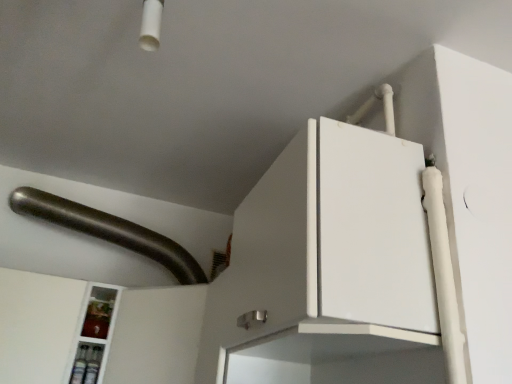
Question: Is point (67, 205) closer or farther from the camera than point (160, 372)?

Choices:
 (A) farther
 (B) closer

Answer: (A)

Question: From a real-world perspective, is satin silver handle at upper left positioned above or below white glossy cabinet at lower left?

Choices:
 (A) below
 (B) above

Answer: (B)

Question: From the image's perspective, relative to white glossy cabinet at lower left, is satin silver handle at upper left above or below?

Choices:
 (A) below
 (B) above

Answer: (B)

Question: Is point coord(174,362) positioned closer to the camera than point coord(131,246)?

Choices:
 (A) farther
 (B) closer

Answer: (B)

Question: Considering the positions of white glossy cabinet at lower left and satin silver handle at upper left in the image, is white glossy cabinet at lower left taller or shorter than satin silver handle at upper left?

Choices:
 (A) short
 (B) tall

Answer: (B)

Question: From a real-world perspective, is white glossy cabinet at lower left positioned above or below satin silver handle at upper left?

Choices:
 (A) below
 (B) above

Answer: (A)

Question: From the image's perspective, is white glossy cabinet at lower left positioned above or below satin silver handle at upper left?

Choices:
 (A) below
 (B) above

Answer: (A)